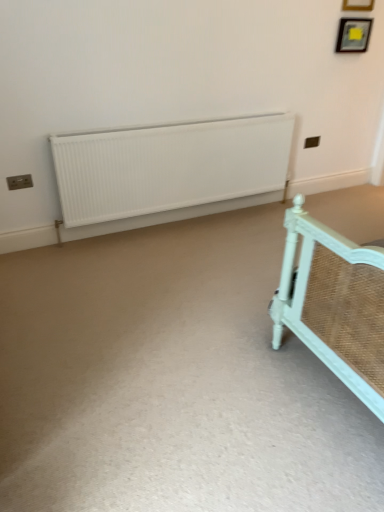
Question: Is white matte radiator at center oriented away from wooden picture frame at upper right, the first picture frame when ordered from top to bottom?

Choices:
 (A) yes
 (B) no

Answer: (B)

Question: From the image's perspective, is white matte radiator at center on top of wooden picture frame at upper right, the first picture frame when ordered from top to bottom?

Choices:
 (A) no
 (B) yes

Answer: (A)

Question: Considering the relative sizes of white matte radiator at center and wooden picture frame at upper right, the first picture frame when ordered from top to bottom, in the image provided, is white matte radiator at center smaller than wooden picture frame at upper right, the first picture frame when ordered from top to bottom,?

Choices:
 (A) no
 (B) yes

Answer: (A)

Question: Would you say wooden picture frame at upper right, the second picture frame in the bottom-to-top sequence, is part of white matte radiator at center's contents?

Choices:
 (A) yes
 (B) no

Answer: (B)

Question: From a real-world perspective, is white matte radiator at center under wooden picture frame at upper right, the first picture frame when ordered from top to bottom?

Choices:
 (A) no
 (B) yes

Answer: (B)

Question: In the image, is white matte radiator at center positioned in front of or behind wooden picture frame at upper right, acting as the 2th picture frame starting from the top?

Choices:
 (A) behind
 (B) front

Answer: (B)

Question: In terms of size, does white matte radiator at center appear bigger or smaller than wooden picture frame at upper right, acting as the 2th picture frame starting from the top?

Choices:
 (A) small
 (B) big

Answer: (B)

Question: Is white matte radiator at center wider or thinner than wooden picture frame at upper right, acting as the 2th picture frame starting from the top?

Choices:
 (A) wide
 (B) thin

Answer: (A)

Question: Considering the positions of white matte radiator at center and wooden picture frame at upper right, acting as the 2th picture frame starting from the top, in the image, is white matte radiator at center taller or shorter than wooden picture frame at upper right, acting as the 2th picture frame starting from the top,?

Choices:
 (A) tall
 (B) short

Answer: (A)

Question: From a real-world perspective, is white matte radiator at center positioned above or below wooden picture frame at upper right, the first picture frame when ordered from top to bottom?

Choices:
 (A) above
 (B) below

Answer: (B)

Question: From the image's perspective, is white matte radiator at center positioned above or below wooden picture frame at upper right, the second picture frame in the bottom-to-top sequence?

Choices:
 (A) below
 (B) above

Answer: (A)

Question: In the image, is white matte radiator at center positioned in front of or behind wooden picture frame at upper right, the second picture frame in the bottom-to-top sequence?

Choices:
 (A) front
 (B) behind

Answer: (A)

Question: Is white matte radiator at center wider or thinner than wooden picture frame at upper right, the first picture frame when ordered from top to bottom?

Choices:
 (A) wide
 (B) thin

Answer: (A)

Question: Is wooden picture frame at upper right, which is the 1th picture frame in bottom-to-top order, inside the boundaries of wooden picture frame at upper right, the first picture frame when ordered from top to bottom, or outside?

Choices:
 (A) inside
 (B) outside

Answer: (B)

Question: In terms of size, does wooden picture frame at upper right, which is the 1th picture frame in bottom-to-top order, appear bigger or smaller than wooden picture frame at upper right, the first picture frame when ordered from top to bottom?

Choices:
 (A) big
 (B) small

Answer: (A)